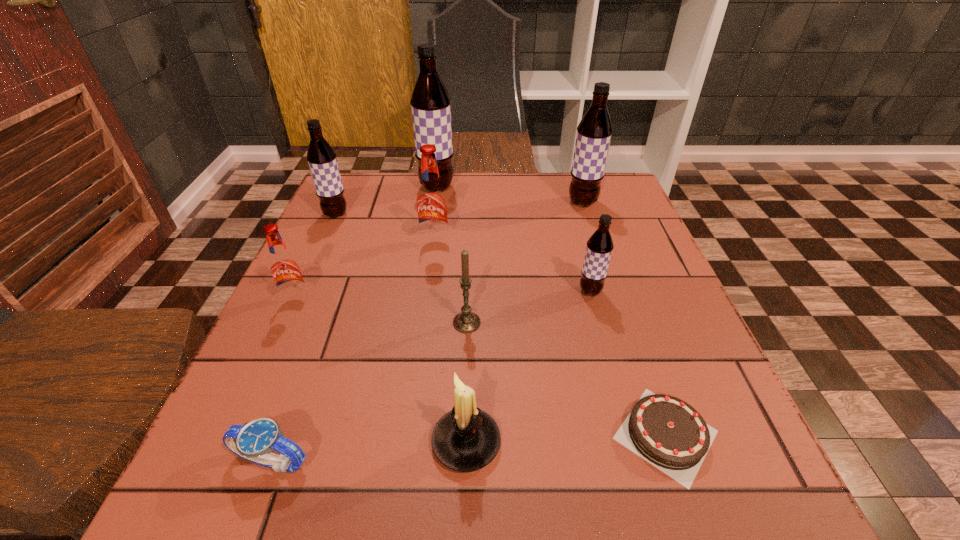
Where is `the seventh farthest object`? This screenshot has width=960, height=540. the seventh farthest object is located at coordinates (466, 321).

This screenshot has width=960, height=540. Identify the location of gray candle. (466, 321).

In order to click on white candle holder in this screenshot , I will do `click(465, 439)`.

Where is `watch`? Image resolution: width=960 pixels, height=540 pixels. watch is located at coordinates (254, 441).

Identify the location of the ninth tallest object. (254, 441).

Identify the location of chocolate cake. (667, 432).

At what (x,y) coordinates should I click in order to perform the action: click on the shortest object. Please return your answer as a coordinate pair (x, y). This screenshot has width=960, height=540. Looking at the image, I should click on (667, 432).

Locate an element on the screen. free space located 0.180m on the front of the tallest object is located at coordinates (429, 237).

Locate an element on the screen. Image resolution: width=960 pixels, height=540 pixels. vacant space located on the back of the second biggest brown root beer is located at coordinates (573, 174).

Locate an element on the screen. free space located on the back of the third nearest root beer is located at coordinates (440, 209).